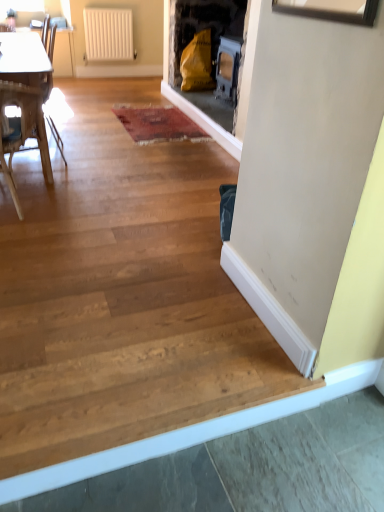
The width and height of the screenshot is (384, 512). I want to click on vacant area located to the right-hand side of wooden chair at left, so click(x=85, y=207).